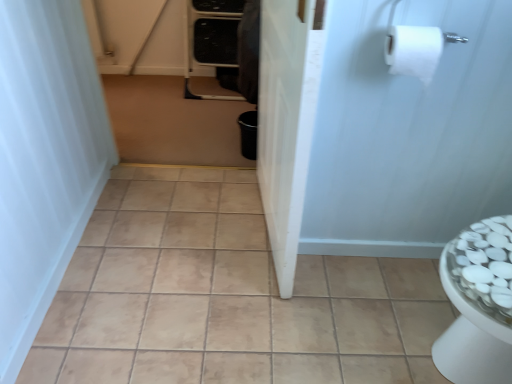
Question: Which is correct: white matte toilet paper at upper right is inside white glossy screen door at center, acting as the first screen door starting from the left, or outside of it?

Choices:
 (A) outside
 (B) inside

Answer: (A)

Question: Relative to white glossy screen door at center, which is counted as the second screen door, starting from the right, is white matte toilet paper at upper right in front or behind?

Choices:
 (A) behind
 (B) front

Answer: (A)

Question: Considering the real-world distances, which object is farthest from the white matte shower curtain at left?

Choices:
 (A) beige ceramic tile at center
 (B) white matte toilet paper at upper right
 (C) white matte screen door at upper right, which ranks as the 2th screen door in left-to-right order
 (D) brown matte trash can at center
 (E) white glossy screen door at center, which is counted as the second screen door, starting from the right

Answer: (B)

Question: Based on their relative distances, which object is nearer to the white matte toilet paper at upper right?

Choices:
 (A) beige ceramic tile at center
 (B) brown matte trash can at center
 (C) white glossy screen door at center, which is counted as the second screen door, starting from the right
 (D) white matte screen door at upper right, which ranks as the 2th screen door in left-to-right order
 (E) white matte shower curtain at left

Answer: (D)